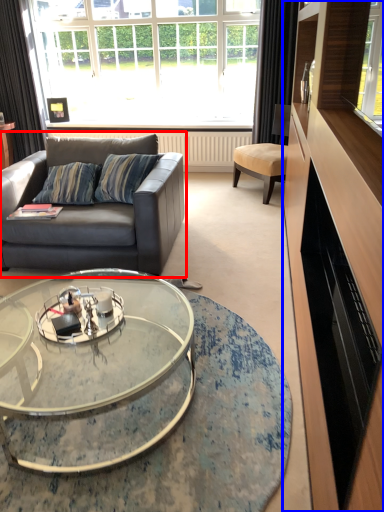
Question: Which object is further to the camera taking this photo, studio couch (highlighted by a red box) or entertainment center (highlighted by a blue box)?

Choices:
 (A) studio couch
 (B) entertainment center

Answer: (A)